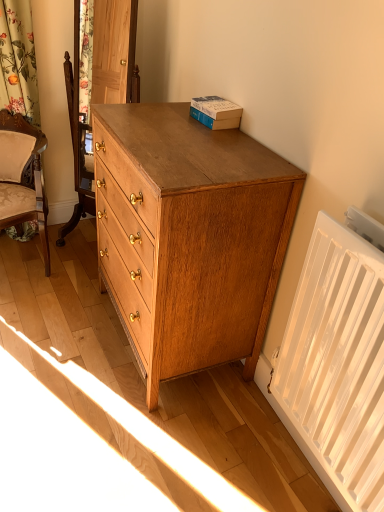
Locate an element on the screen. The width and height of the screenshot is (384, 512). vacant space in front of hardcover book at upper right is located at coordinates (231, 139).